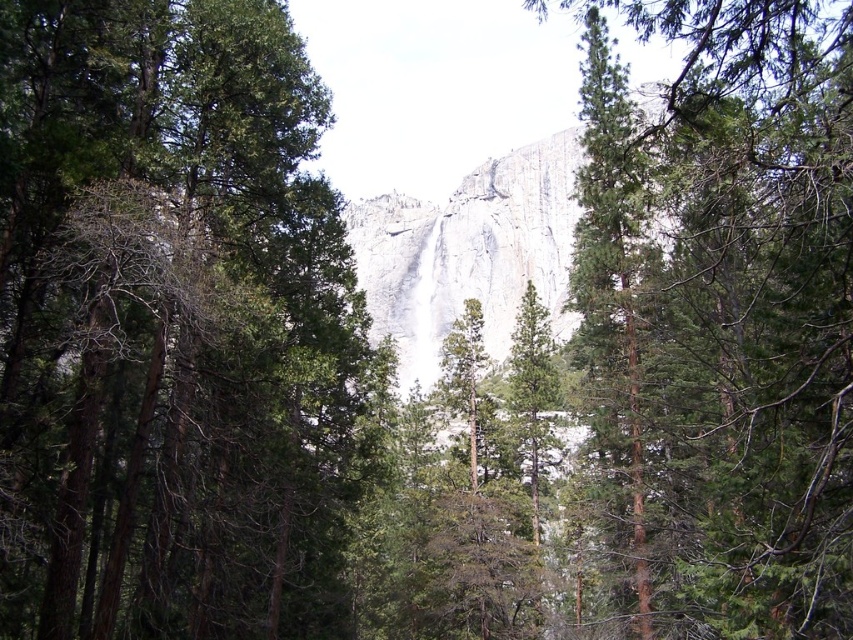
Question: Does green coniferous tree at center have a larger size compared to gray rock face at center?

Choices:
 (A) yes
 (B) no

Answer: (B)

Question: Does gray rock face at center lie in front of green textured tree at center?

Choices:
 (A) no
 (B) yes

Answer: (A)

Question: Which point is closer to the camera?

Choices:
 (A) (125, 435)
 (B) (529, 230)
 (C) (596, 35)
 (D) (814, 276)

Answer: (D)

Question: Which object appears closest to the camera in this image?

Choices:
 (A) green textured tree at center
 (B) green coniferous tree at center
 (C) gray rock face at center
 (D) green matte tree at center

Answer: (B)

Question: Can you confirm if green coniferous tree at center is positioned above green textured tree at center?

Choices:
 (A) yes
 (B) no

Answer: (A)

Question: Which point is closer to the camera?

Choices:
 (A) green textured tree at center
 (B) green coniferous tree at center
 (C) gray rock face at center

Answer: (B)